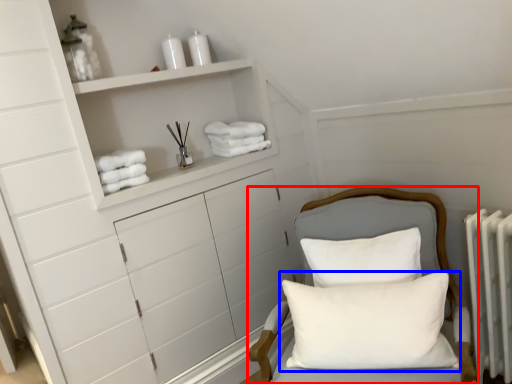
Question: Which point is closer to the camera, furniture (highlighted by a red box) or pillow (highlighted by a blue box)?

Choices:
 (A) furniture
 (B) pillow

Answer: (A)